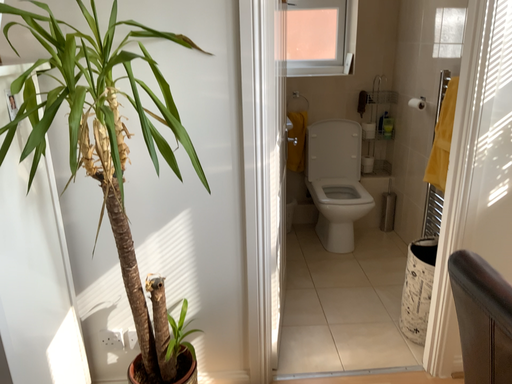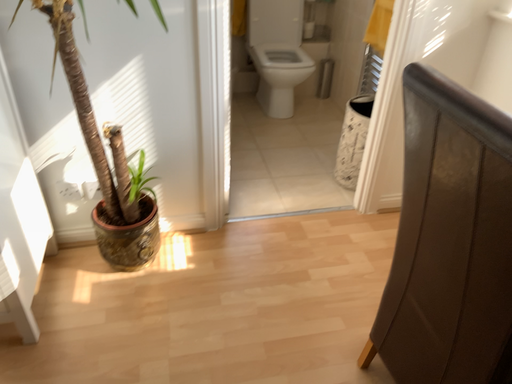
Question: Which way did the camera rotate in the video?

Choices:
 (A) rotated downward
 (B) rotated upward

Answer: (A)